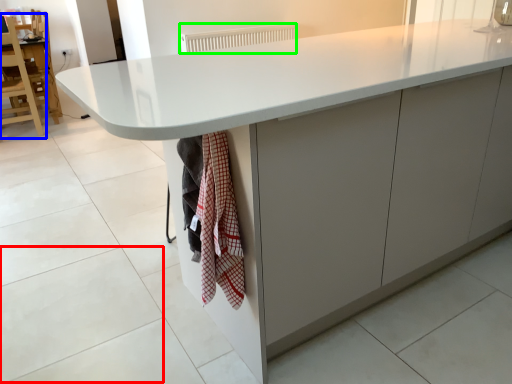
Question: Based on their relative distances, which object is nearer to granite (highlighted by a red box)? Choose from chair (highlighted by a blue box) and radiator (highlighted by a green box).

Choices:
 (A) chair
 (B) radiator

Answer: (A)